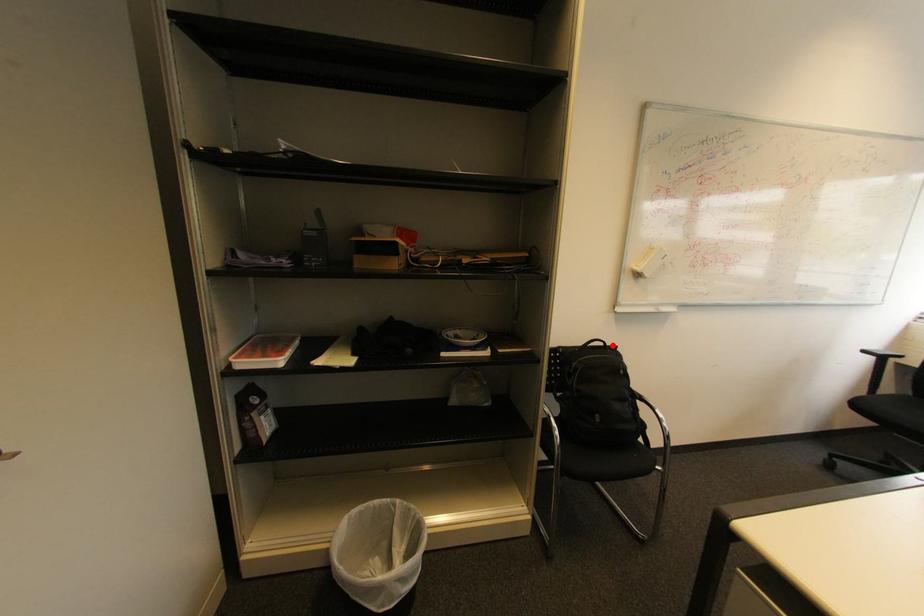
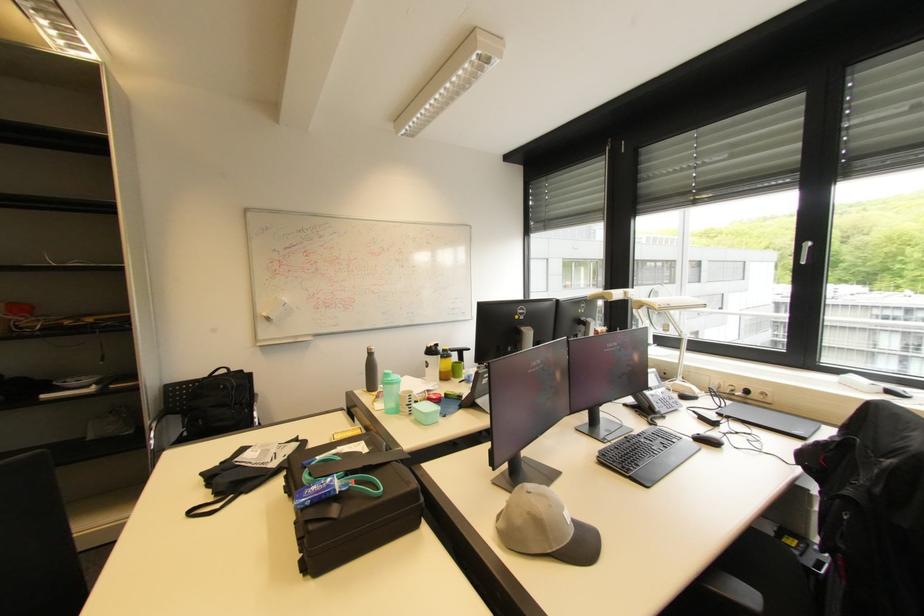
Question: I am providing you with two images of the same scene from different viewpoints. A red point is marked on the first image. Is the red point's position out of view in image 2?

Choices:
 (A) Yes
 (B) No

Answer: (B)